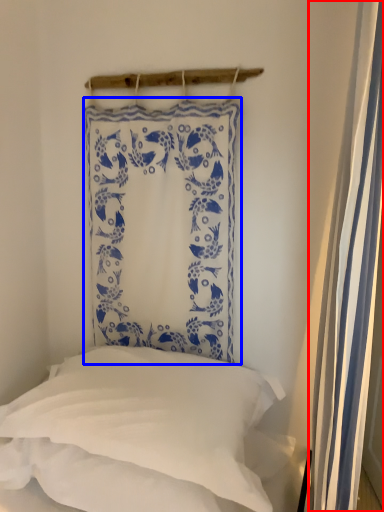
Question: Which object appears closest to the camera in this image, shower curtain (highlighted by a red box) or curtain (highlighted by a blue box)?

Choices:
 (A) shower curtain
 (B) curtain

Answer: (A)